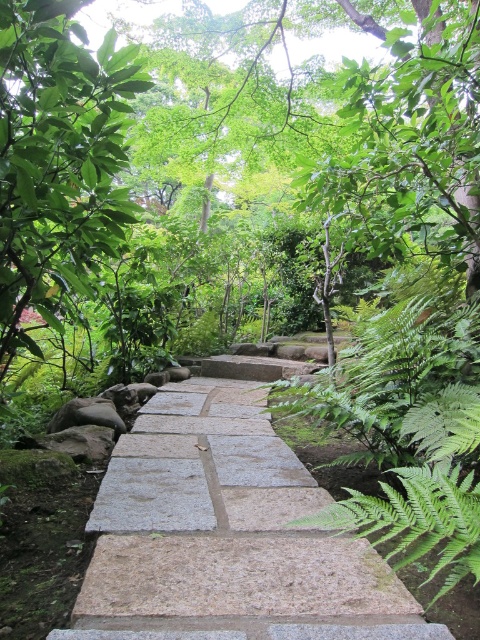
You are a hiker walking along the gray stone path at center and want to take a photo of the green leafy tree at upper left. Since the path is narrow, will you have to move to the side to get a clear shot of the tree?

The gray stone path at center is wider than the green leafy tree at upper left, so you can likely stay on the path without needing to move to the side to capture the tree in your photo.

You are standing at the starting point of the forest pathway and see two points marked in the image. The first point is labeled as point (427, 627) and the second is point (14, 157). Which point is closer to you as you begin your walk?

Point (14, 157) is closer to you because it is behind point (427, 627), which is in front of it.